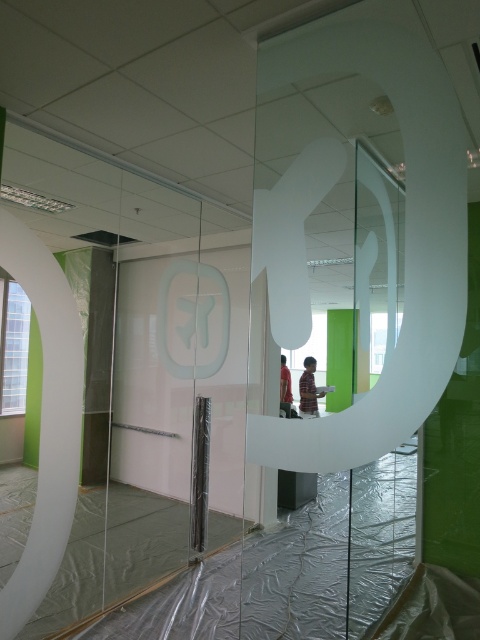
Does white frosted glass logo at center have a lesser height compared to striped shirt at center?

In fact, white frosted glass logo at center may be taller than striped shirt at center.

Does point (195, 269) lie in front of point (314, 410)?

That is True.

Where is `white frosted glass logo at center`? This screenshot has height=640, width=480. white frosted glass logo at center is located at coordinates (167, 320).

Can you confirm if striped shirt at center is positioned to the left of matte black shirt at center?

Incorrect, striped shirt at center is not on the left side of matte black shirt at center.

Who is more distant from viewer, (305, 412) or (289, 376)?

The point (289, 376) is behind.

Does point (299, 388) lie behind point (282, 369)?

Yes.

Find the location of `striped shirt at center`. striped shirt at center is located at coordinates (309, 388).

Can you confirm if white frosted glass logo at center is smaller than matte black shirt at center?

Correct, white frosted glass logo at center occupies less space than matte black shirt at center.

The height and width of the screenshot is (640, 480). Describe the element at coordinates (167, 320) in the screenshot. I see `white frosted glass logo at center` at that location.

Locate an element on the screen. white frosted glass logo at center is located at coordinates (167, 320).